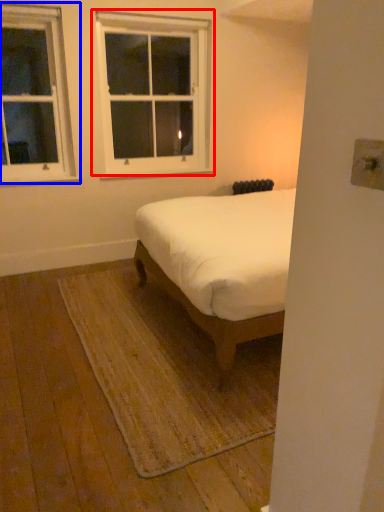
Question: Which object is closer to the camera taking this photo, window (highlighted by a red box) or window (highlighted by a blue box)?

Choices:
 (A) window
 (B) window

Answer: (B)